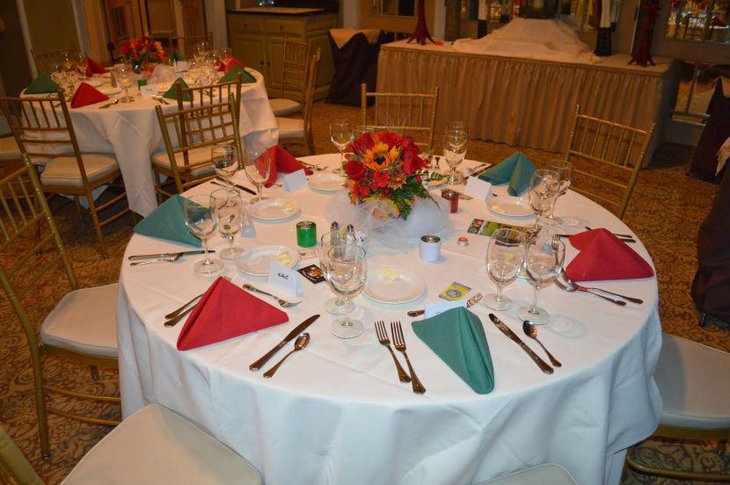
Where is `table cloth`? This screenshot has height=485, width=730. table cloth is located at coordinates (349, 376).